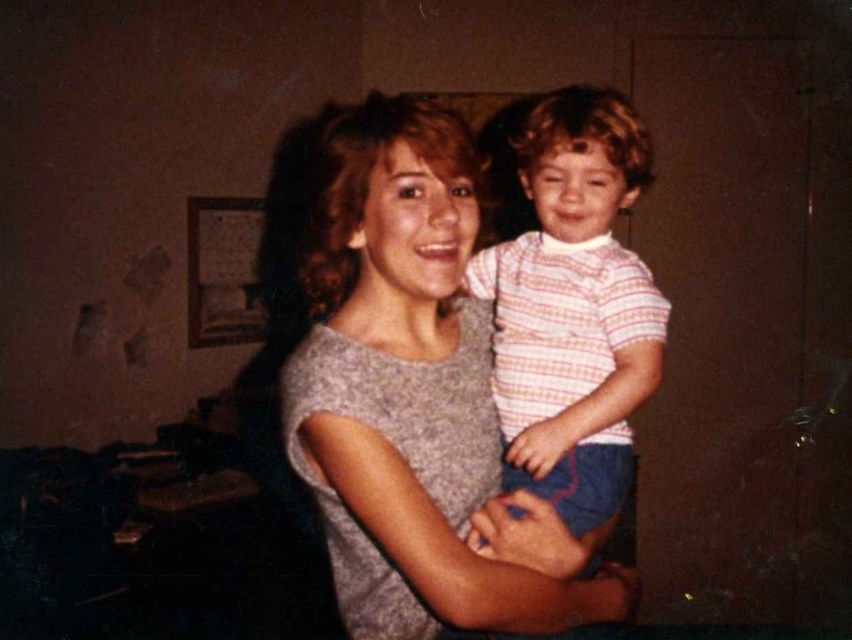
Question: Can you confirm if gray matte shirt at center is positioned above striped cotton shirt at center?

Choices:
 (A) no
 (B) yes

Answer: (A)

Question: Which of the following is the closest to the observer?

Choices:
 (A) (617, 307)
 (B) (602, 620)

Answer: (B)

Question: Does gray matte shirt at center come in front of striped cotton shirt at center?

Choices:
 (A) yes
 (B) no

Answer: (A)

Question: Is gray matte shirt at center further to camera compared to striped cotton shirt at center?

Choices:
 (A) yes
 (B) no

Answer: (B)

Question: Which point is closer to the camera?

Choices:
 (A) striped cotton shirt at center
 (B) gray matte shirt at center

Answer: (B)

Question: Which object appears farthest from the camera in this image?

Choices:
 (A) gray matte shirt at center
 (B) striped cotton shirt at center

Answer: (B)